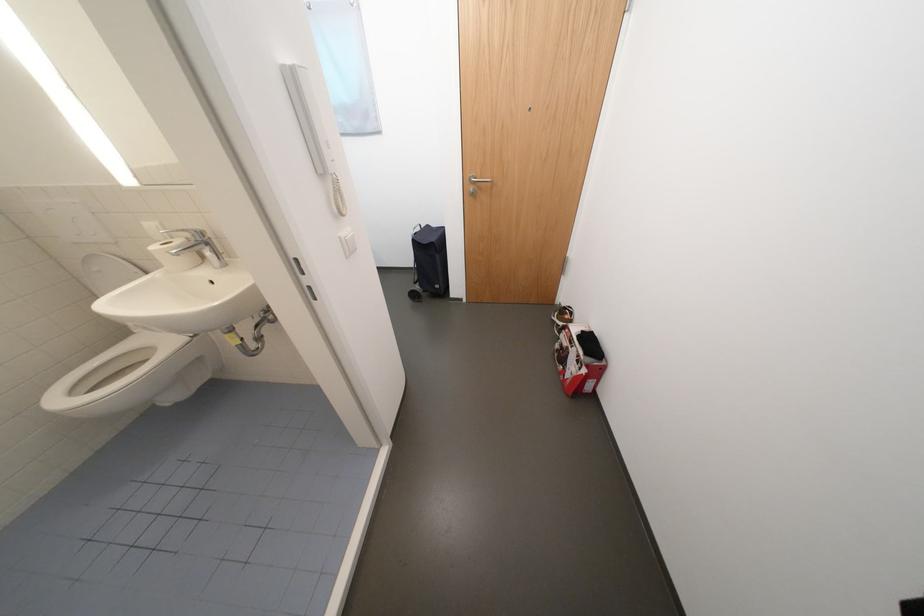
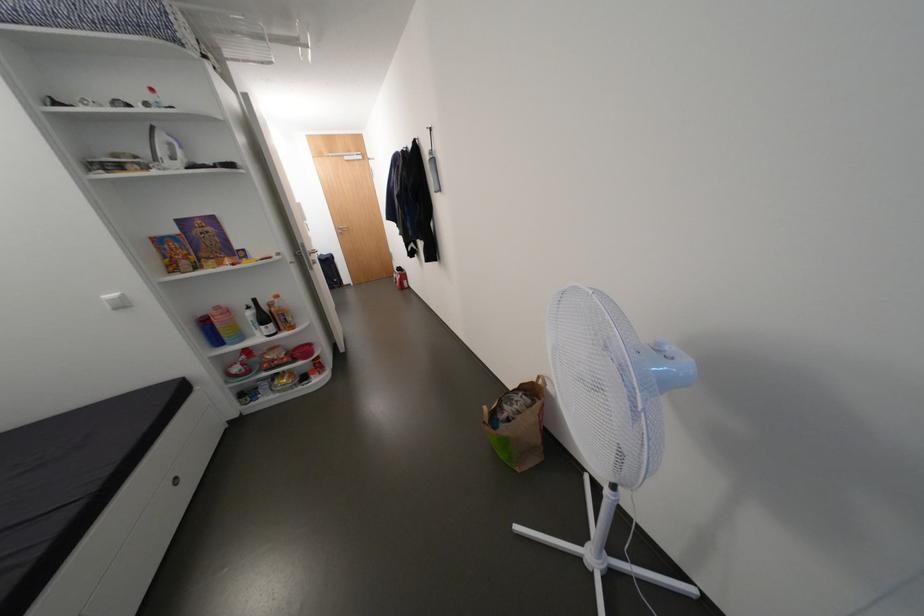
Where in the second image is the point corresponding to [586,338] from the first image?

(405, 270)